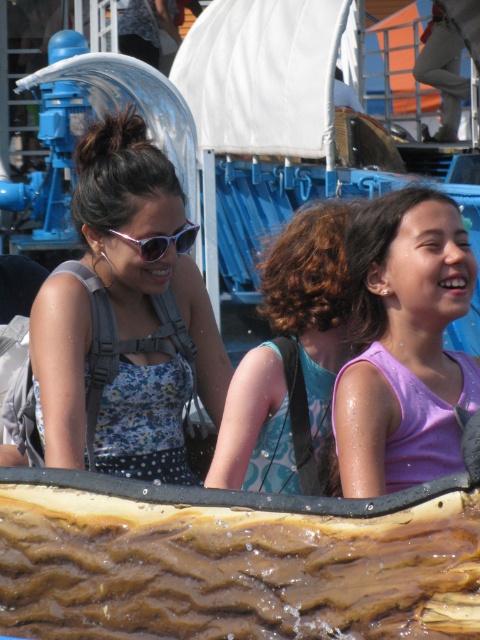
You are a photographer trying to capture the purple matte tank top at center and the matte pink plastic sunglasses at upper left in the same frame. Based on their positions, which item would you need to focus on first if you want to include both in your shot?

The purple matte tank top at center is positioned under the matte pink plastic sunglasses at upper left, so you would need to focus on the matte pink plastic sunglasses at upper left first to ensure both are in the frame.

Based on the coordinates provided, which object is located at point (x=145, y=300) in the image?

The point (x=145, y=300) marks the location of the floral fabric dress at left.